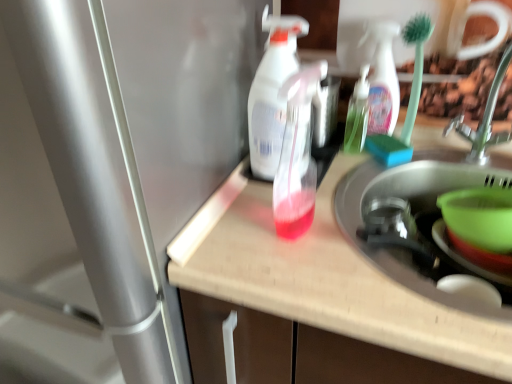
You are a GUI agent. You are given a task and a screenshot of the screen. Output one action in this format:
    pyautogui.click(x=<x>, y=<y>)
    Task: Click on the vacant area that is situated to the right of translucent plastic spray bottle at center, the second bottle in the back-to-front sequence
    Image resolution: width=512 pixels, height=384 pixels.
    Given the screenshot: What is the action you would take?
    pyautogui.click(x=353, y=231)